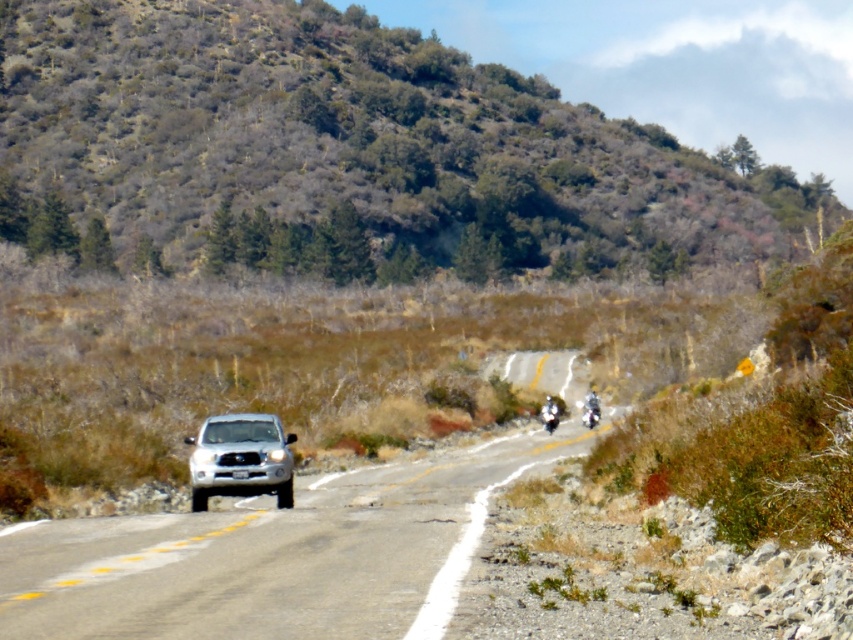
Between point (262, 102) and point (271, 428), which one is positioned behind?

Positioned behind is point (262, 102).

Does point (109, 152) lie in front of point (273, 426)?

No, (109, 152) is further to viewer.

In the scene shown: Who is more distant from viewer, [392,99] or [192,506]?

The point [392,99] is behind.

Find the location of `green shrubbery at upper center`. green shrubbery at upper center is located at coordinates (352, 141).

Is point (167, 531) less distant than point (596, 401)?

Yes, it is.

Who is more forward, (x=556, y=429) or (x=599, y=404)?

Point (x=556, y=429) is in front.

Between point (238, 556) and point (596, 400), which one is positioned behind?

Positioned behind is point (596, 400).

Find the location of a particular element. This screenshot has height=640, width=853. silver metallic suv at center is located at coordinates (276, 554).

Can you confirm if satin silver suv at center is taller than white glossy motorcycle at center-right?

In fact, satin silver suv at center may be shorter than white glossy motorcycle at center-right.

Which is more to the left, satin silver suv at center or white glossy motorcycle at center-right?

satin silver suv at center

Which is in front, point (193, 474) or point (546, 429)?

Point (193, 474) is in front.

Locate an element on the screen. This screenshot has width=853, height=640. satin silver suv at center is located at coordinates (241, 458).